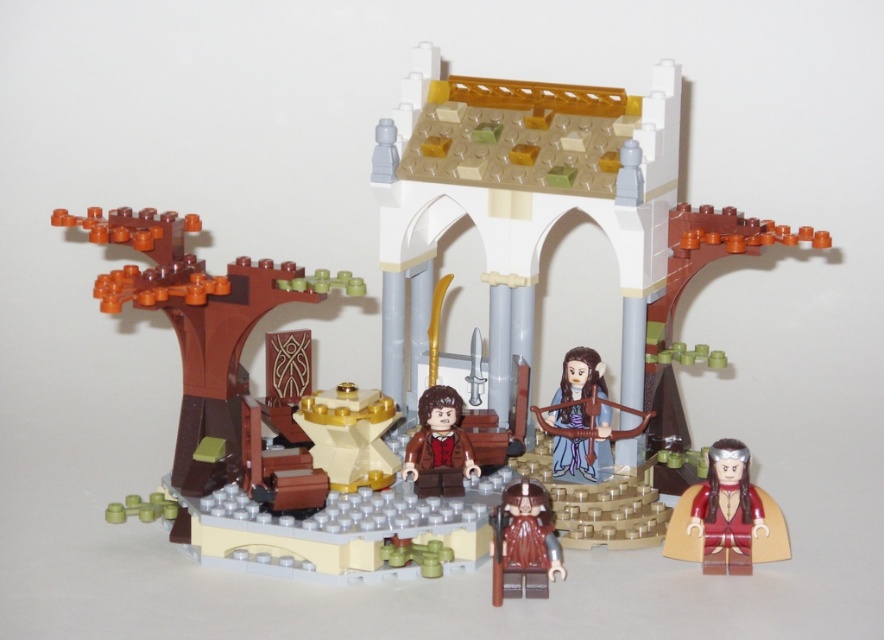
Is smooth red cape at lower right further to camera compared to blue fabric bow at center?

That is False.

Does smooth red cape at lower right appear under blue fabric bow at center?

Indeed, smooth red cape at lower right is positioned under blue fabric bow at center.

What do you see at coordinates (728, 509) in the screenshot? I see `smooth red cape at lower right` at bounding box center [728, 509].

At what (x,y) coordinates should I click in order to perform the action: click on smooth red cape at lower right. Please return your answer as a coordinate pair (x, y). The image size is (884, 640). Looking at the image, I should click on (728, 509).

Is smooth red cape at lower right to the left of brown matte jacket at center from the viewer's perspective?

No, smooth red cape at lower right is not to the left of brown matte jacket at center.

Which is behind, point (705, 547) or point (442, 449)?

The point (442, 449) is more distant.

Where is `smooth red cape at lower right`? The image size is (884, 640). smooth red cape at lower right is located at coordinates (728, 509).

This screenshot has width=884, height=640. What do you see at coordinates (523, 541) in the screenshot? I see `brown matte minifigure at center` at bounding box center [523, 541].

Who is more distant from viewer, (498, 577) or (591, 376)?

The point (591, 376) is behind.

Does point (531, 502) come farther from viewer compared to point (554, 396)?

No, it is not.

The width and height of the screenshot is (884, 640). I want to click on brown matte minifigure at center, so 523,541.